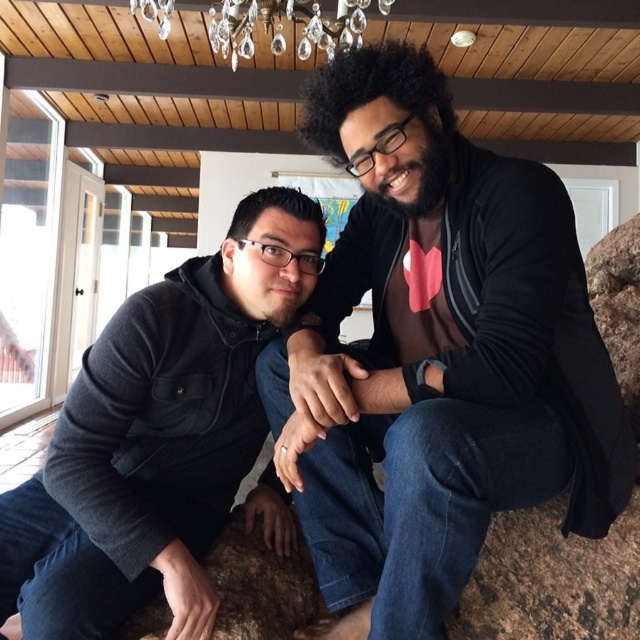
Is dark gray hoodie at left smaller than crystal glass chandelier at upper center?

Yes, dark gray hoodie at left is smaller than crystal glass chandelier at upper center.

How far apart are dark gray hoodie at left and crystal glass chandelier at upper center?

5.76 feet

Between point (177, 305) and point (266, 8), which one is positioned behind?

Point (266, 8)

The width and height of the screenshot is (640, 640). Find the location of `dark gray hoodie at left`. dark gray hoodie at left is located at coordinates (156, 436).

Can you confirm if black matte jacket at center is wider than crystal glass chandelier at upper center?

In fact, black matte jacket at center might be narrower than crystal glass chandelier at upper center.

Where is `black matte jacket at center`? black matte jacket at center is located at coordinates (435, 356).

Identify the location of black matte jacket at center. (435, 356).

Which is behind, point (506, 422) or point (289, 276)?

Point (289, 276)

Does black matte jacket at center have a larger size compared to dark gray hoodie at left?

Yes, black matte jacket at center is bigger than dark gray hoodie at left.

Locate an element on the screen. black matte jacket at center is located at coordinates (435, 356).